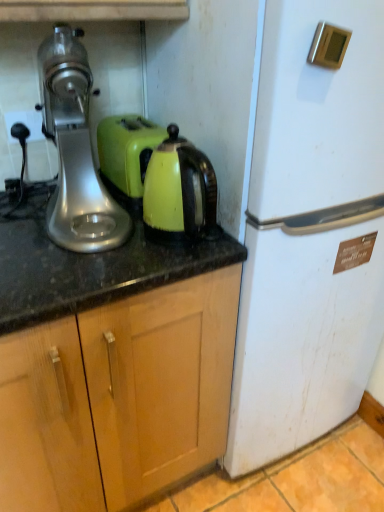
This screenshot has width=384, height=512. I want to click on free location above wooden cabinet at center (from a real-world perspective), so click(94, 233).